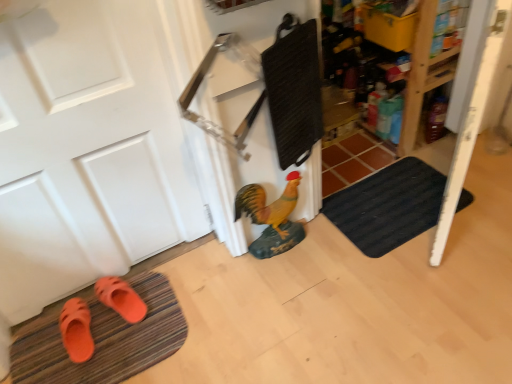
Locate an element on the screen. Image resolution: width=512 pixels, height=384 pixels. vacant area in front of black textured bath mat at lower right, the second bath mat positioned from the left is located at coordinates (420, 288).